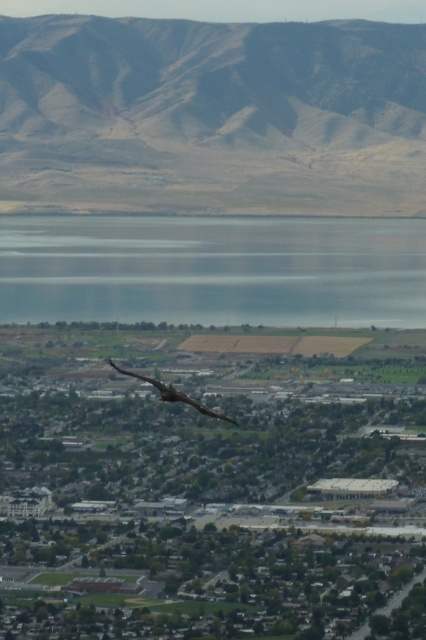
Is point (187, 88) farther from camera compared to point (189, 397)?

Yes, point (187, 88) is farther from viewer.

Between brown/drymountain at upper center and dark brown feathers at center, which one is positioned higher?

brown/drymountain at upper center is above.

Find the location of a particular element. Image resolution: width=426 pixels, height=640 pixels. brown/drymountain at upper center is located at coordinates (212, 116).

Is blue glass water at center smaller than dark brown feathers at center?

Incorrect, blue glass water at center is not smaller in size than dark brown feathers at center.

What are the coordinates of `blue glass water at center` in the screenshot? It's located at (213, 269).

Is brown/drymountain at upper center to the left of blue glass water at center from the viewer's perspective?

Indeed, brown/drymountain at upper center is positioned on the left side of blue glass water at center.

Does point (408, 29) lie in front of point (423, 225)?

No, it is behind (423, 225).

Is point (138, 56) less distant than point (28, 280)?

No.

Image resolution: width=426 pixels, height=640 pixels. I want to click on brown/drymountain at upper center, so click(212, 116).